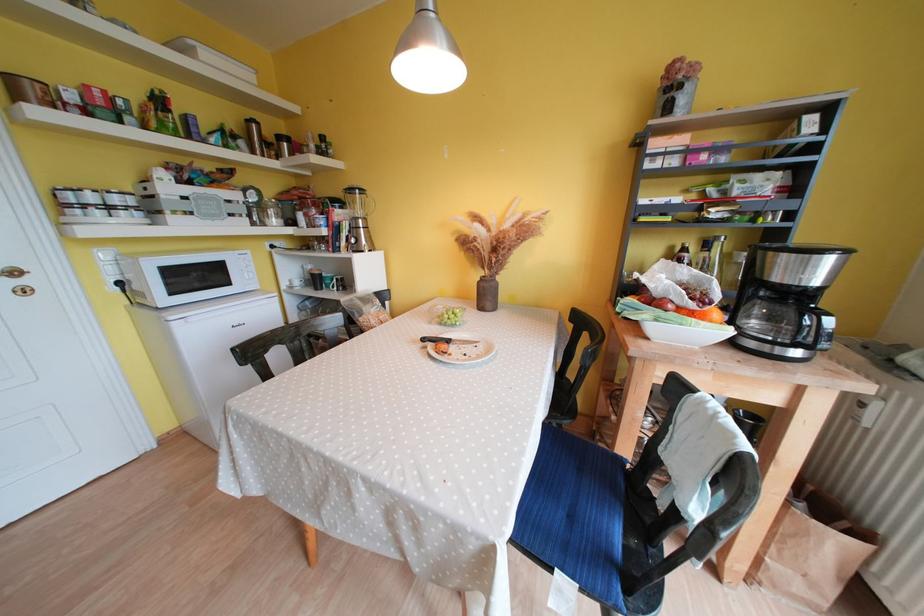
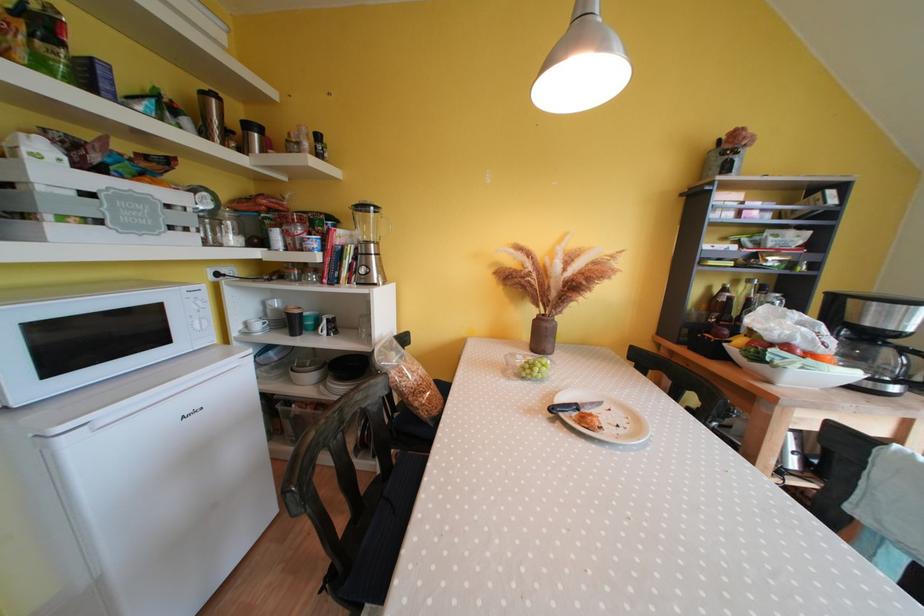
Find the pixel in the second image that matches (x=735, y=336) in the first image.

(858, 378)